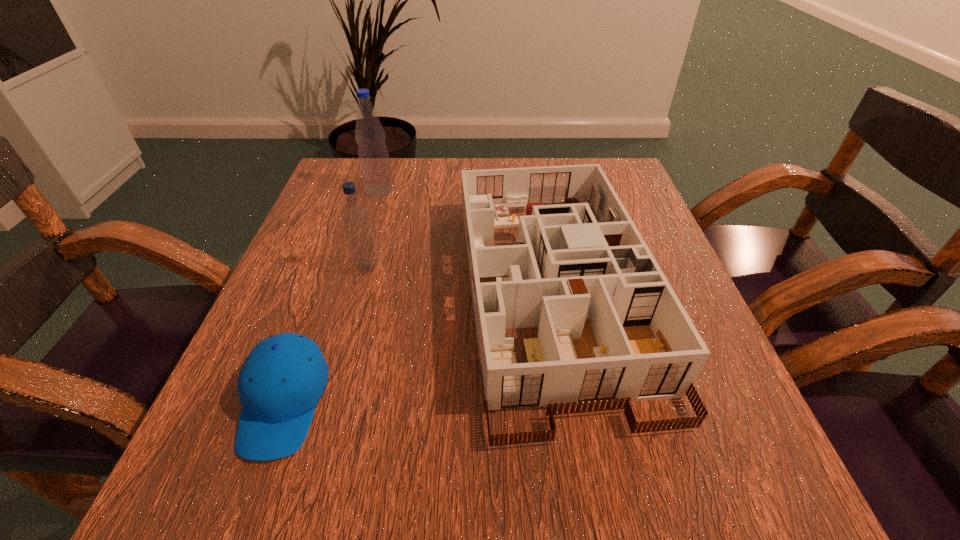
At what (x,y) coordinates should I click in order to perform the action: click on blank space located 0.050m on the front-facing side of the shortest object. Please return your answer as a coordinate pair (x, y). Looking at the image, I should click on (247, 504).

The width and height of the screenshot is (960, 540). I want to click on water bottle that is at the far edge, so click(373, 155).

Locate an element on the screen. The image size is (960, 540). dollhouse present at the far edge is located at coordinates (612, 330).

At what (x,y) coordinates should I click in order to perform the action: click on dollhouse that is positioned at the near edge. Please return your answer as a coordinate pair (x, y). The image size is (960, 540). Looking at the image, I should click on (612, 330).

The image size is (960, 540). I want to click on cap located in the near edge section of the desktop, so click(283, 378).

Where is `cap at the left edge`? The height and width of the screenshot is (540, 960). cap at the left edge is located at coordinates (283, 378).

Identify the location of object at the right edge. (612, 330).

You are a GUI agent. You are given a task and a screenshot of the screen. Output one action in this format:
    pyautogui.click(x=<x>, y=<y>)
    Task: Click on the object that is at the far left corner
    The width and height of the screenshot is (960, 540).
    Given the screenshot: What is the action you would take?
    pyautogui.click(x=373, y=155)

I want to click on object present at the near left corner, so click(x=283, y=378).

Image resolution: width=960 pixels, height=540 pixels. Identify the location of object that is at the far right corner. (612, 330).